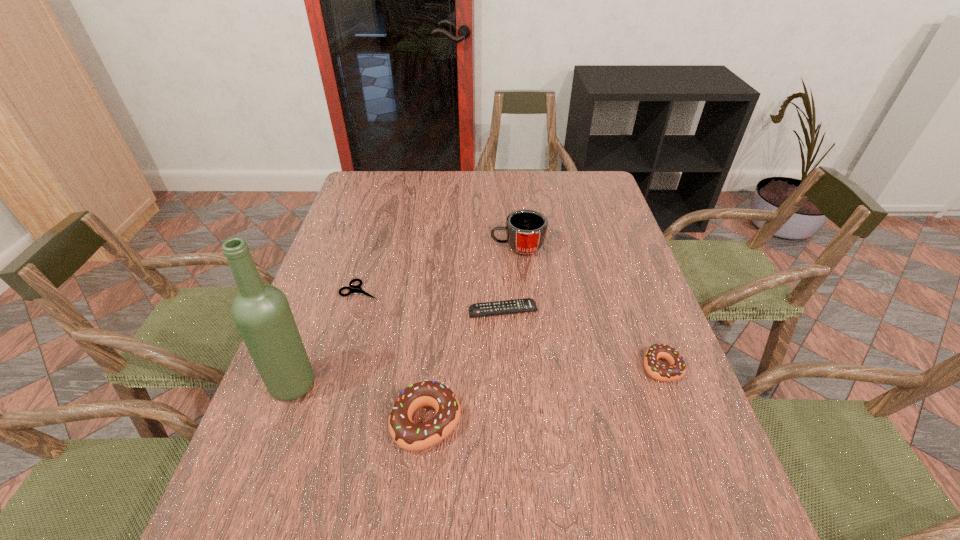
Image resolution: width=960 pixels, height=540 pixels. I want to click on shears positioned at the left edge, so click(353, 289).

Find the location of `wine bottle that is at the left edge`. wine bottle that is at the left edge is located at coordinates (261, 312).

You are a GUI agent. You are given a task and a screenshot of the screen. Output one action in this format:
    pyautogui.click(x=<x>, y=<y>)
    Task: Click on the object present at the right edge
    The width and height of the screenshot is (960, 540).
    Given the screenshot: What is the action you would take?
    pyautogui.click(x=677, y=368)

The image size is (960, 540). Identify the location of free region at the far edge. (424, 192).

In the image, there is a desktop. Where is `vacant space at the near edge`? The image size is (960, 540). vacant space at the near edge is located at coordinates (582, 475).

At what (x,y) coordinates should I click in order to perform the action: click on free region at the left edge of the desktop. Please return your answer as a coordinate pair (x, y). Image resolution: width=960 pixels, height=540 pixels. Looking at the image, I should click on (381, 224).

This screenshot has width=960, height=540. I want to click on free point at the right edge, so point(608,239).

Where is `free space at the far left corner`? This screenshot has height=540, width=960. free space at the far left corner is located at coordinates (355, 192).

In the image, there is a desktop. Identify the location of blank space at the near left corner. Image resolution: width=960 pixels, height=540 pixels. (294, 449).

Locate an element on the screen. Image resolution: width=960 pixels, height=540 pixels. free space between the fourth shortest object and the second tallest object is located at coordinates (472, 334).